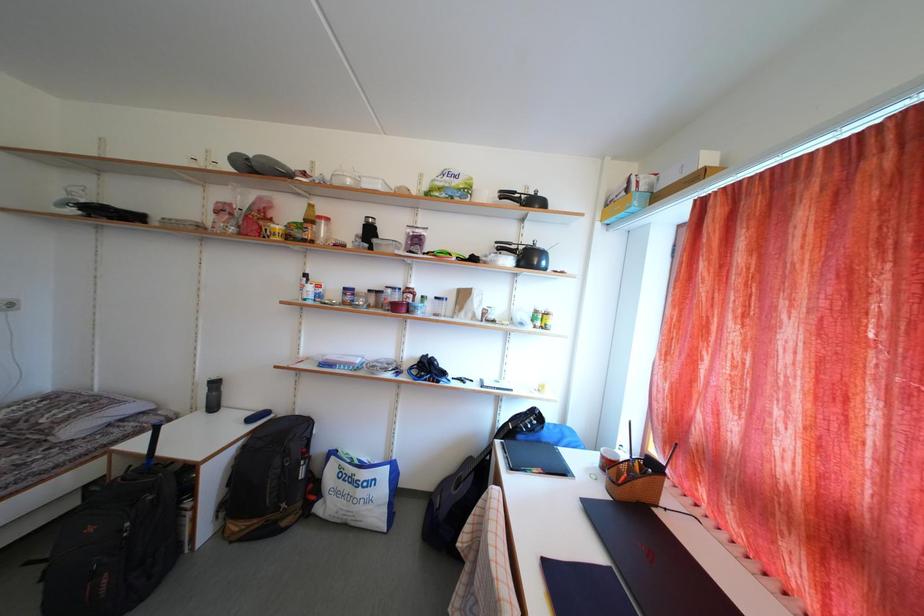
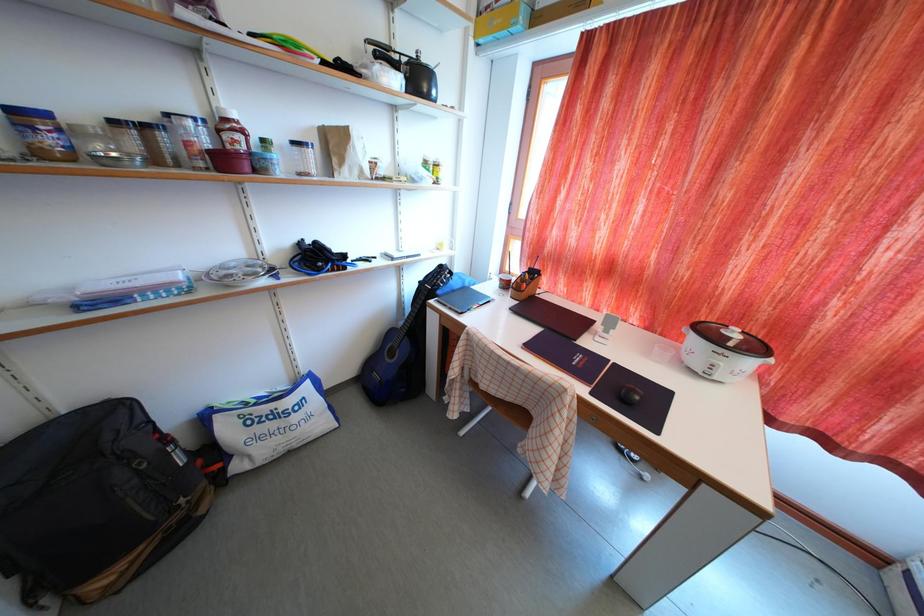
Based on the continuous images, in which direction is the camera rotating?

The camera rotated toward right-down.